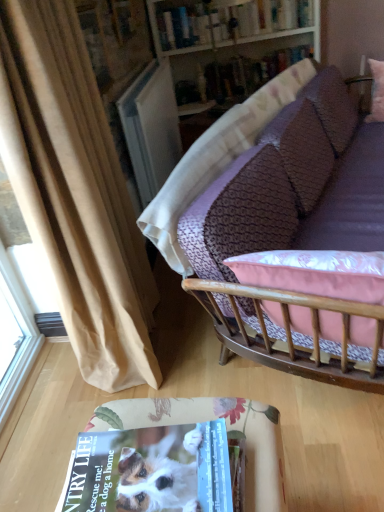
Question: From the image's perspective, relative to wooden bookshelf at upper center, is purple fabric couch at upper right above or below?

Choices:
 (A) below
 (B) above

Answer: (A)

Question: Based on their positions, is purple fabric couch at upper right located to the left or right of wooden bookshelf at upper center?

Choices:
 (A) right
 (B) left

Answer: (A)

Question: Considering the real-world distances, which object is closest to the purple fabric couch at upper right?

Choices:
 (A) floral fabric table at lower center
 (B) hardcover book at upper center, positioned as the 1th book in top-to-bottom order
 (C) wooden bookshelf at upper center
 (D) hardcover book at upper center, which is counted as the second book, starting from the top
 (E) beige fabric curtain at left

Answer: (E)

Question: Estimate the real-world distances between objects in this image. Which object is closer to the floral fabric table at lower center?

Choices:
 (A) purple fabric couch at upper right
 (B) hardcover book at upper center, which is counted as the second book, starting from the bottom
 (C) wooden bookshelf at upper center
 (D) hardcover book at upper center, the 1th book from the bottom
 (E) beige fabric curtain at left

Answer: (E)